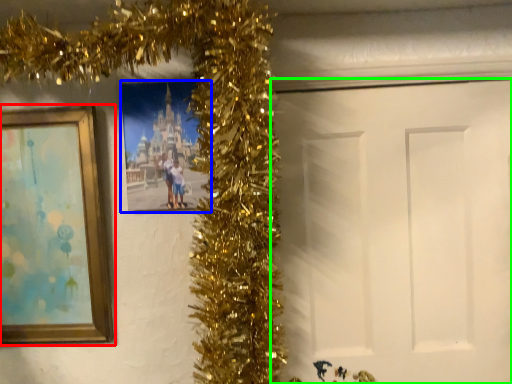
Question: Which is nearer to the picture frame (highlighted by a red box)? picture frame (highlighted by a blue box) or door (highlighted by a green box).

Choices:
 (A) picture frame
 (B) door

Answer: (A)